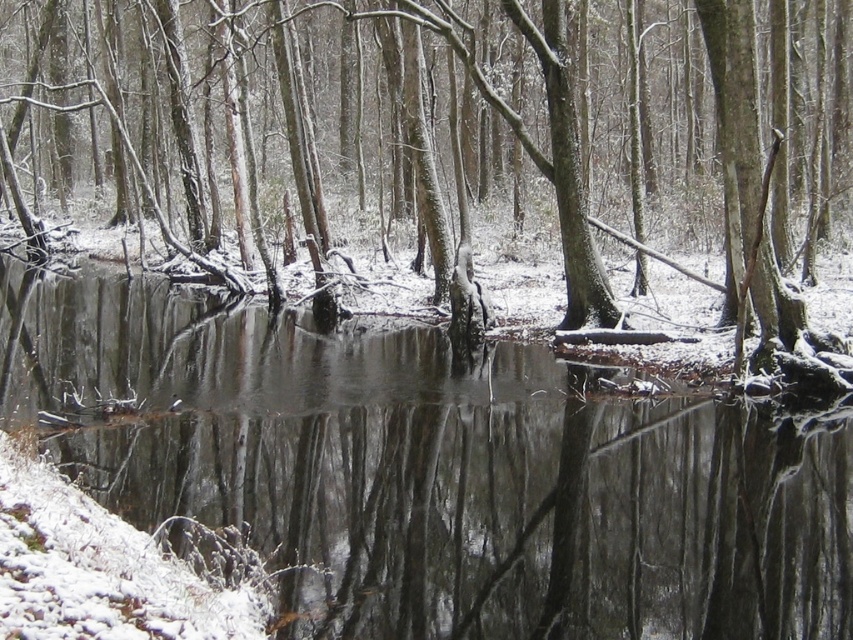
Question: Which point is closer to the camera taking this photo?

Choices:
 (A) (16, 413)
 (B) (497, 132)

Answer: (A)

Question: Does clear water at center have a greater width compared to smooth bark tree at center?

Choices:
 (A) yes
 (B) no

Answer: (B)

Question: Which object is farther from the camera taking this photo?

Choices:
 (A) clear water at center
 (B) smooth bark tree at center

Answer: (B)

Question: Does clear water at center appear on the left side of smooth bark tree at center?

Choices:
 (A) no
 (B) yes

Answer: (A)

Question: Which object appears farthest from the camera in this image?

Choices:
 (A) smooth bark tree at center
 (B) clear water at center

Answer: (A)

Question: Is clear water at center positioned behind smooth bark tree at center?

Choices:
 (A) no
 (B) yes

Answer: (A)